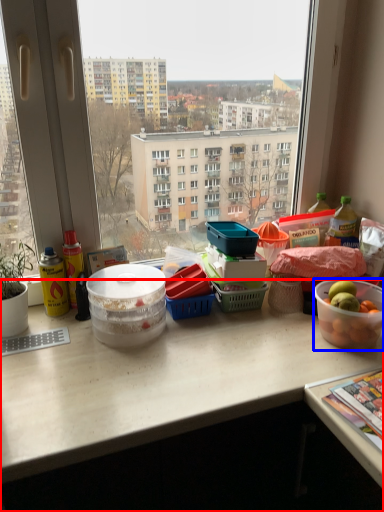
Question: Which object appears farthest to the camera in this image, desk (highlighted by a red box) or bowl (highlighted by a blue box)?

Choices:
 (A) desk
 (B) bowl

Answer: (B)